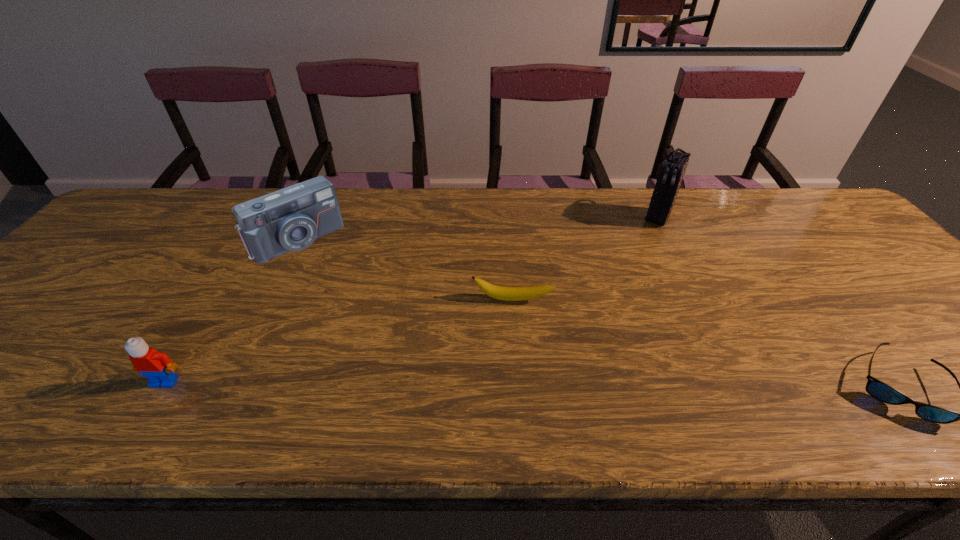
The width and height of the screenshot is (960, 540). I want to click on Lego, so click(x=157, y=367).

Locate an element on the screen. camera is located at coordinates (291, 219).

Identify the location of the fourth object from left to right. The height and width of the screenshot is (540, 960). (672, 170).

Locate an element on the screen. clutch bag is located at coordinates [672, 170].

In order to click on banana in this screenshot , I will do `click(497, 292)`.

Image resolution: width=960 pixels, height=540 pixels. Find the location of `the fourth tallest object`. the fourth tallest object is located at coordinates (497, 292).

This screenshot has height=540, width=960. Find the location of `vacant space situated on the lens of the camera`. vacant space situated on the lens of the camera is located at coordinates (378, 330).

The height and width of the screenshot is (540, 960). What are the coordinates of `free space located on the lens of the camera` in the screenshot? It's located at (353, 301).

Identify the location of free space located 0.210m on the lens of the camera. The height and width of the screenshot is (540, 960). (355, 303).

At what (x,y) coordinates should I click in order to perform the action: click on free spot located 0.090m with the zip open on the fourth object from left to right. Please return your answer as a coordinate pair (x, y). Looking at the image, I should click on (643, 244).